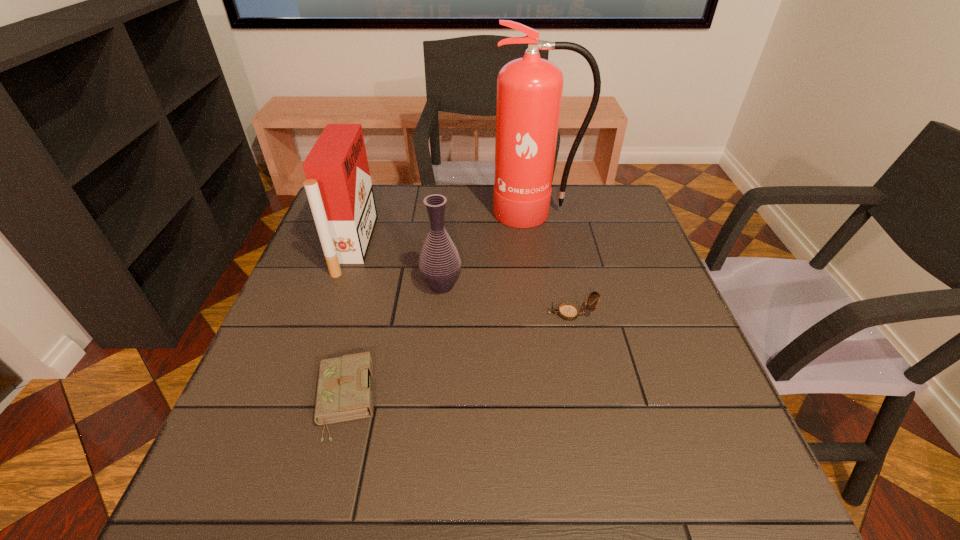
Image resolution: width=960 pixels, height=540 pixels. In order to click on fire extinguisher in this screenshot , I will do `click(529, 90)`.

Find the location of a particular element. cigarette case is located at coordinates (339, 189).

The height and width of the screenshot is (540, 960). I want to click on the third object from right to left, so click(x=439, y=263).

The width and height of the screenshot is (960, 540). What are the coordinates of `the third shortest object` in the screenshot? It's located at (439, 263).

I want to click on the fourth tallest object, so click(567, 311).

Image resolution: width=960 pixels, height=540 pixels. In order to click on the second nearest object in this screenshot , I will do `click(567, 311)`.

Where is `the nearest object`? This screenshot has height=540, width=960. the nearest object is located at coordinates (343, 394).

Image resolution: width=960 pixels, height=540 pixels. Find the location of `the shortest object`. the shortest object is located at coordinates (343, 394).

At what (x,y) coordinates should I click in order to perform the action: click on vacant space located 0.330m towards the nozzle of the fire extinguisher. Please return your answer as a coordinate pair (x, y). The image size is (960, 540). Looking at the image, I should click on (553, 312).

The width and height of the screenshot is (960, 540). Identify the location of free location located 0.100m on the front-facing side of the cigarette case. (406, 245).